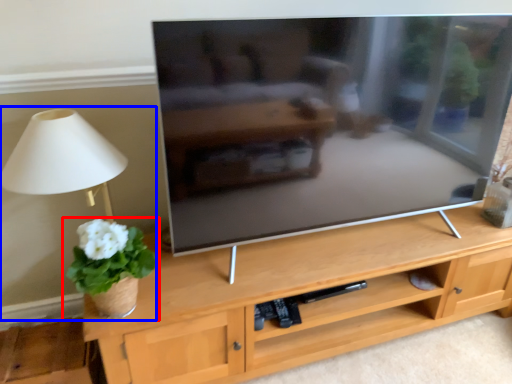
Question: Among these objects, which one is nearest to the camera, houseplant (highlighted by a red box) or table lamp (highlighted by a blue box)?

Choices:
 (A) houseplant
 (B) table lamp

Answer: (A)